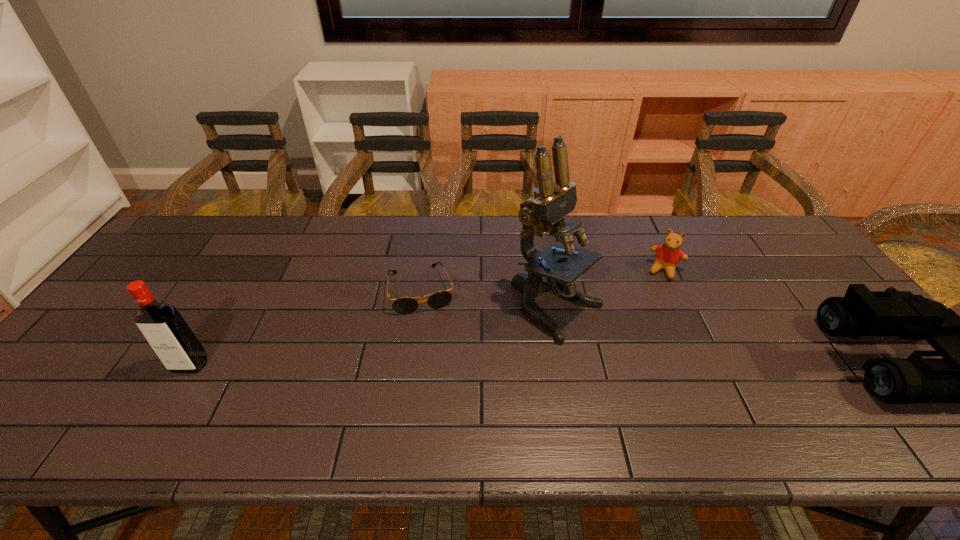
Where is `vacant point located on the front-facing side of the second object from right to left`? This screenshot has width=960, height=540. vacant point located on the front-facing side of the second object from right to left is located at coordinates (657, 292).

Identify the location of vacant region located 0.090m on the front-facing side of the second object from right to left. This screenshot has height=540, width=960. (655, 299).

What are the coordinates of `vacant position located on the front-facing side of the fourth object from right to left` in the screenshot? It's located at (438, 364).

Image resolution: width=960 pixels, height=540 pixels. In order to click on free space located on the front-facing side of the fourth object from right to left in this screenshot , I will do `click(442, 385)`.

Where is `vacant space located on the front-facing side of the fourth object from right to left`? The width and height of the screenshot is (960, 540). vacant space located on the front-facing side of the fourth object from right to left is located at coordinates (440, 375).

Where is `free region located at the eyepieces of the third object from right to left`? The height and width of the screenshot is (540, 960). free region located at the eyepieces of the third object from right to left is located at coordinates (646, 364).

Identify the location of free spot located at the eyepieces of the third object from right to left. (624, 351).

The image size is (960, 540). Identify the location of free space located 0.110m at the eyepieces of the third object from right to left. (636, 357).

Identify the location of object that is at the far edge. The image size is (960, 540). (668, 255).

The width and height of the screenshot is (960, 540). Find the location of `vacant area at the far edge of the desktop`. vacant area at the far edge of the desktop is located at coordinates [639, 241].